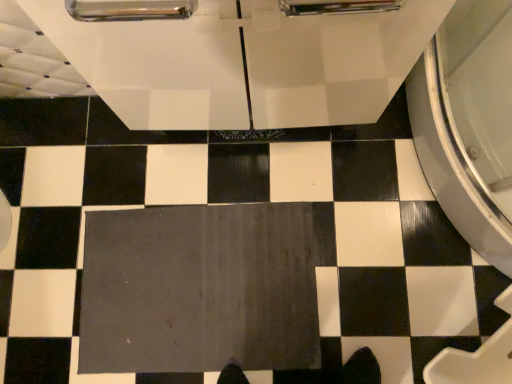
The width and height of the screenshot is (512, 384). Find the location of `empty space that is ontop of dark gray rubber bath mat at center (from a real-world perspective)`. empty space that is ontop of dark gray rubber bath mat at center (from a real-world perspective) is located at coordinates (188, 289).